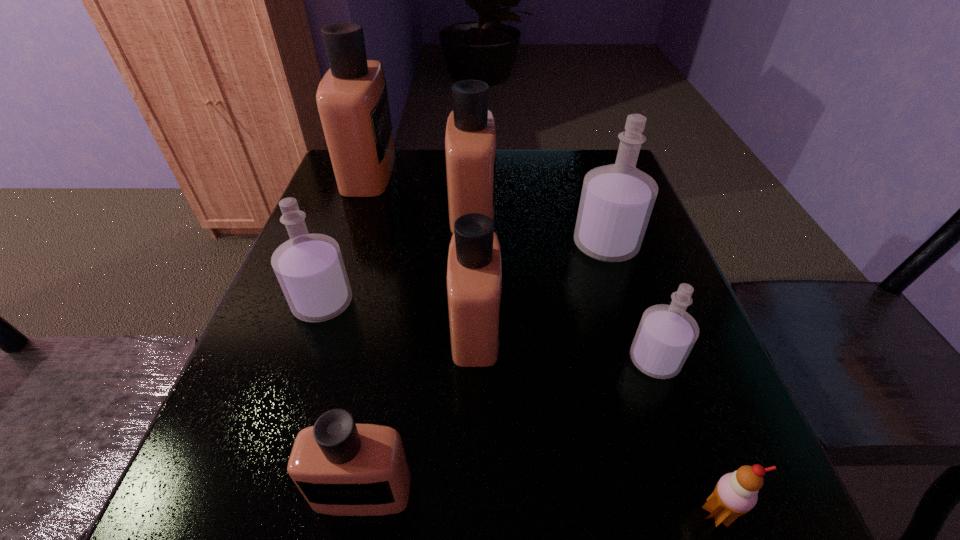
Where is `icecream`? This screenshot has height=540, width=960. icecream is located at coordinates (735, 494).

This screenshot has width=960, height=540. What are the coordinates of `vacant space located on the front label of the tallest object` in the screenshot? It's located at (437, 171).

Find the location of a particular element. This screenshot has height=540, width=960. free region located on the front label of the second biggest beige perfume is located at coordinates (580, 209).

The image size is (960, 540). I want to click on vacant space located on the back of the biggest purple perfume, so click(x=577, y=154).

The height and width of the screenshot is (540, 960). Find the location of `vacant space located 0.330m on the back of the second biggest purple perfume`. vacant space located 0.330m on the back of the second biggest purple perfume is located at coordinates (361, 193).

Where is `free region located on the front label of the third biggest beige perfume`? This screenshot has width=960, height=540. free region located on the front label of the third biggest beige perfume is located at coordinates (531, 328).

Identify the location of blank space located 0.100m on the left of the smallest purple perfume. (572, 360).

Identify the location of perfume situated at the near edge. The image size is (960, 540). (341, 468).

Locate an element on the screen. This screenshot has width=960, height=540. icecream present at the near edge is located at coordinates [x=735, y=494].

The height and width of the screenshot is (540, 960). Identify the location of icecream at the right edge. (735, 494).